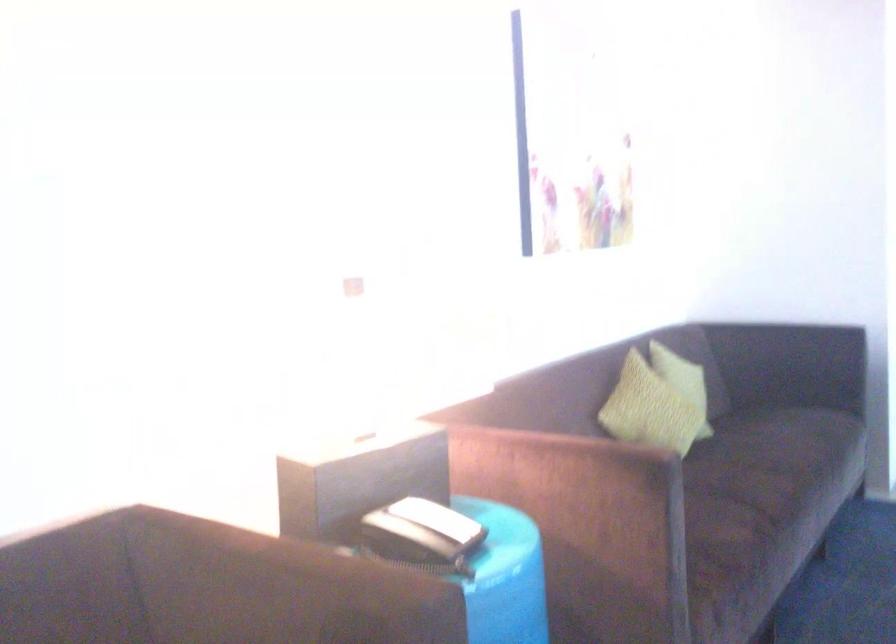
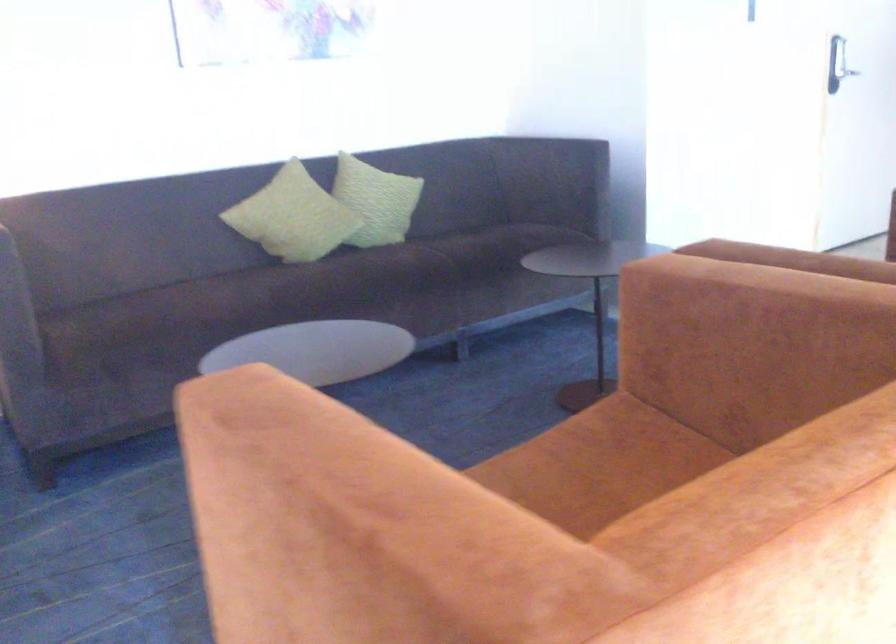
Where in the second image is the point corresponding to [765,478] from the first image?

(270, 290)